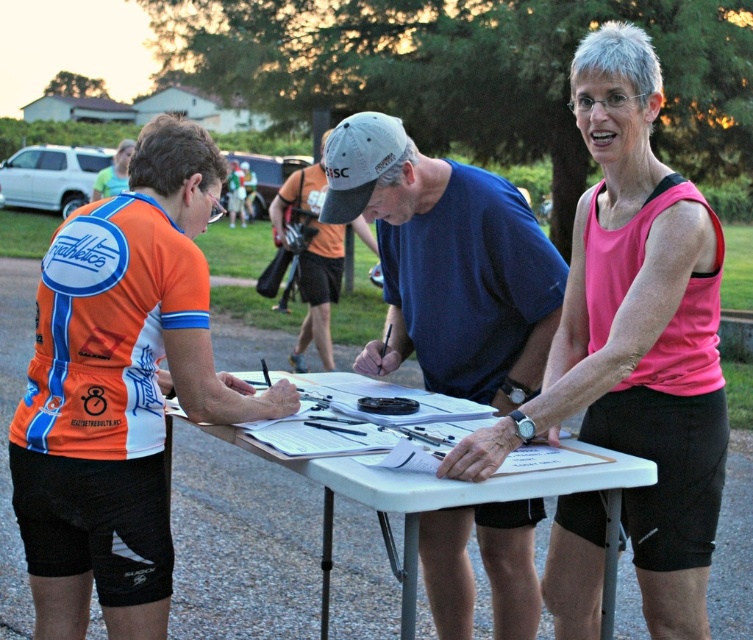
Does orange jersey at left have a greater width compared to orange mesh shirt at center?

Correct, the width of orange jersey at left exceeds that of orange mesh shirt at center.

Between orange jersey at left and orange mesh shirt at center, which one is positioned lower?

orange jersey at left is below.

Which is in front, point (56, 292) or point (325, 268)?

Point (56, 292)

Locate an element on the screen. This screenshot has height=640, width=753. orange jersey at left is located at coordinates (120, 388).

You are a GUI agent. You are given a task and a screenshot of the screen. Output one action in this format:
    pyautogui.click(x=<x>, y=<y>)
    Task: Click on the pink fabric tank top at center
    
    Given the screenshot: What is the action you would take?
    click(636, 336)

This screenshot has width=753, height=640. Identify the location of pink fabric tank top at center. (636, 336).

Can you confirm if orange jersey at left is bigger than blue cotton t-shirt at center?

Indeed, orange jersey at left has a larger size compared to blue cotton t-shirt at center.

Can you confirm if orange jersey at left is wider than blue cotton t-shirt at center?

No.

Where is `orange jersey at left`? The image size is (753, 640). orange jersey at left is located at coordinates (120, 388).